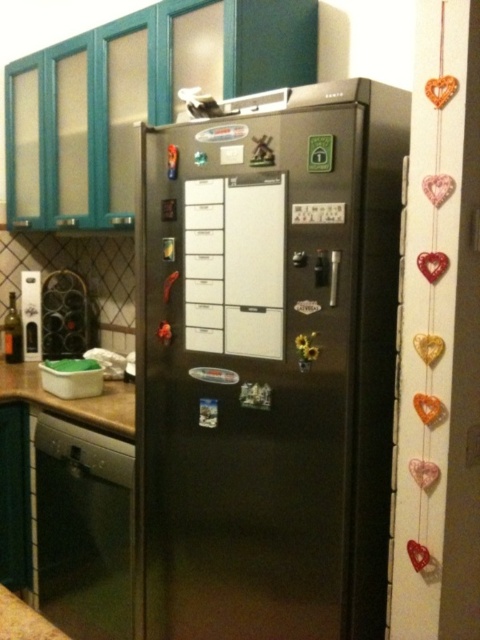
Does satin black refrigerator at center have a lesser width compared to brown wood countertop at lower left?

Yes, satin black refrigerator at center is thinner than brown wood countertop at lower left.

Is point (294, 237) closer to viewer compared to point (29, 376)?

Yes, point (294, 237) is in front of point (29, 376).

Locate an element on the screen. The width and height of the screenshot is (480, 640). satin black refrigerator at center is located at coordinates (269, 365).

Is satin black refrigerator at center above satin black dishwasher at lower left?

Correct, satin black refrigerator at center is located above satin black dishwasher at lower left.

Consider the image. Between satin black refrigerator at center and satin black dishwasher at lower left, which one appears on the right side from the viewer's perspective?

From the viewer's perspective, satin black refrigerator at center appears more on the right side.

Is point (144, 298) in front of point (111, 600)?

Yes, point (144, 298) is in front of point (111, 600).

Find the location of a particular element. The height and width of the screenshot is (640, 480). satin black refrigerator at center is located at coordinates (269, 365).

Is satin black dishwasher at lower left closer to the viewer compared to brown wood countertop at lower left?

Yes.

In the scene shown: Between satin black dishwasher at lower left and brown wood countertop at lower left, which one is positioned higher?

brown wood countertop at lower left is higher up.

Where is `satin black dishwasher at lower left`? Image resolution: width=480 pixels, height=640 pixels. satin black dishwasher at lower left is located at coordinates (84, 529).